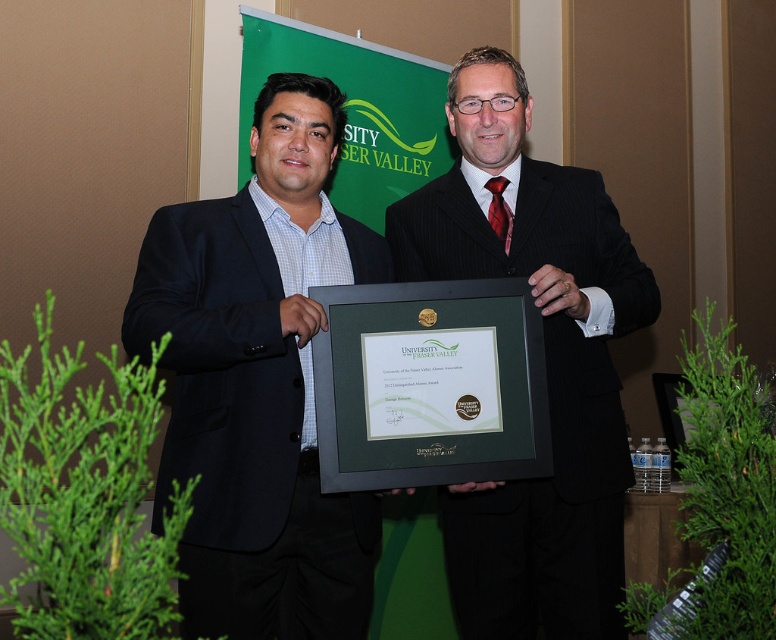
Based on the photo, who is more forward, (622, 332) or (435, 477)?

Point (435, 477)

Which is more to the left, black pinstripe suit at center or green matte plaque at center?

Positioned to the left is green matte plaque at center.

Does point (515, 211) come behind point (511, 308)?

Yes, it is.

You are a GUI agent. You are given a task and a screenshot of the screen. Output one action in this format:
    pyautogui.click(x=<x>, y=<y>)
    Task: Click on the black pinstripe suit at center
    The image size is (776, 640).
    Given the screenshot: What is the action you would take?
    pyautogui.click(x=548, y=403)

Can you confirm if dark blue fabric business suit at center is positioned above green matte plaque at center?

No.

Can you confirm if dark blue fabric business suit at center is smaller than green matte plaque at center?

Incorrect, dark blue fabric business suit at center is not smaller in size than green matte plaque at center.

Is point (293, 429) behind point (355, 298)?

No, (293, 429) is in front of (355, 298).

In order to click on dark blue fabric business suit at center in this screenshot , I will do `click(220, 369)`.

Based on the photo, is black pinstripe suit at center bigger than dark blue fabric business suit at center?

Yes, black pinstripe suit at center is bigger than dark blue fabric business suit at center.

Is black pinstripe suit at center above dark blue fabric business suit at center?

Result: Yes.

The height and width of the screenshot is (640, 776). Identify the location of black pinstripe suit at center. (548, 403).